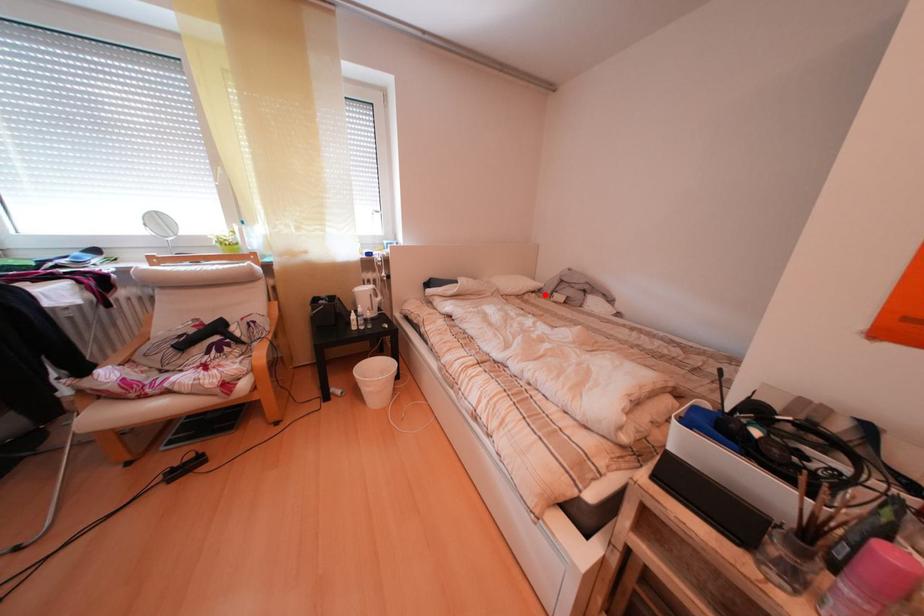
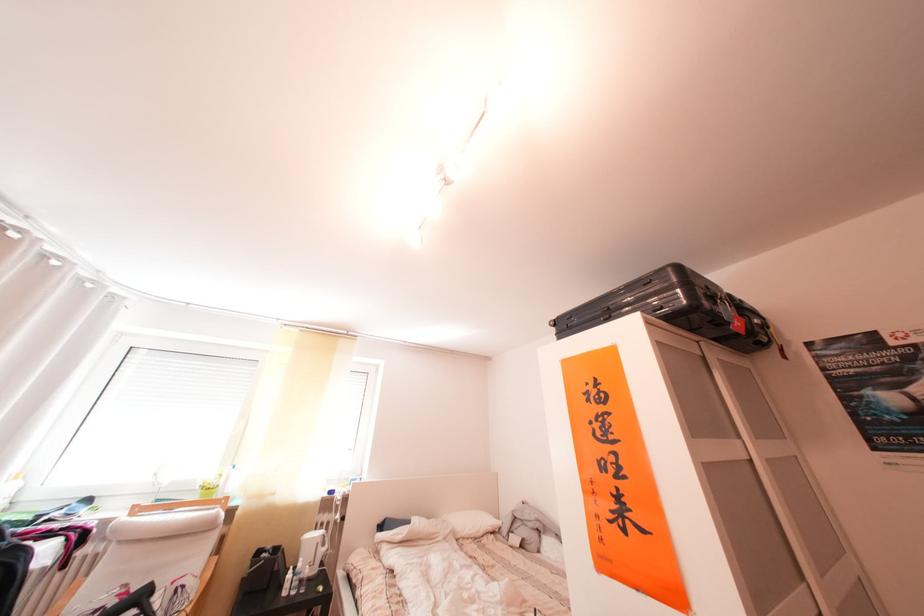
Question: A red point is marked in image1. In image2, is the corresponding 3D point closer to the camera or farther? Reply with the corresponding letter.

Choices:
 (A) The corresponding 3D point is closer.
 (B) The corresponding 3D point is farther.

Answer: (B)